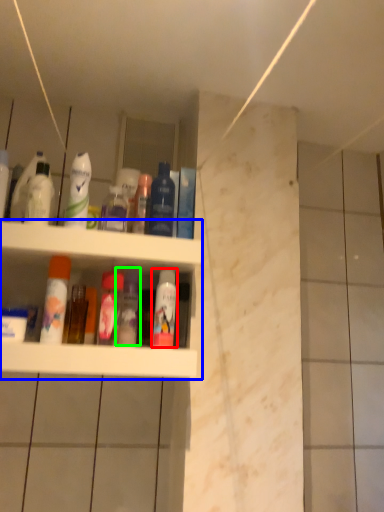
Question: Estimate the real-world distances between objects in this image. Which object is farther from mouthwash (highlighted by a red box), shelf (highlighted by a blue box) or toiletry (highlighted by a green box)?

Choices:
 (A) shelf
 (B) toiletry

Answer: (A)